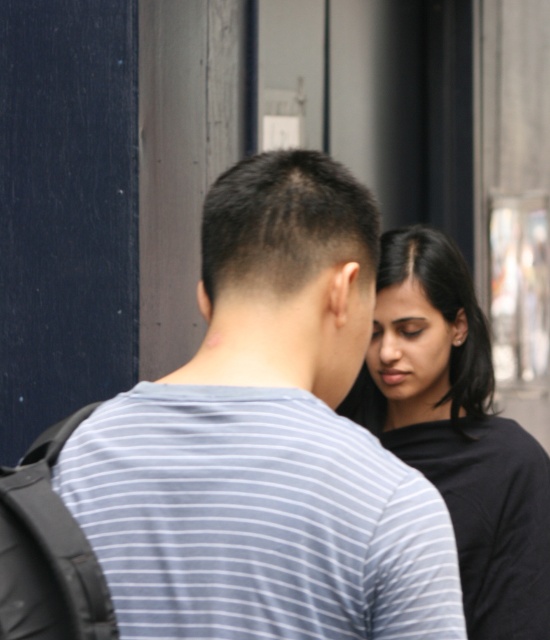
Who is taller, gray striped shirt at center or black matte shirt at right?

black matte shirt at right

Which is behind, point (288, 192) or point (454, 371)?

Point (454, 371)

Is point (234, 269) in front of point (399, 246)?

Yes, point (234, 269) is in front of point (399, 246).

The image size is (550, 640). I want to click on gray striped shirt at center, so click(x=244, y=452).